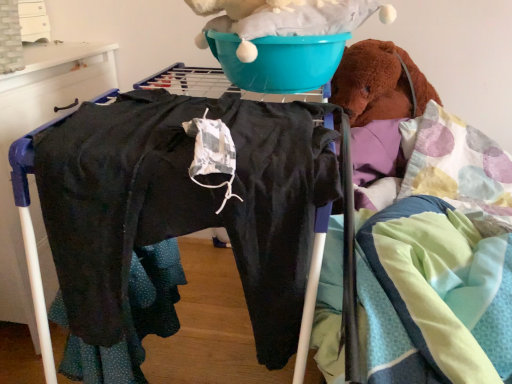
The width and height of the screenshot is (512, 384). What do you see at coordinates (280, 61) in the screenshot?
I see `teal plastic basin at upper center` at bounding box center [280, 61].

Locate an element on the screen. The height and width of the screenshot is (384, 512). teal plastic basin at upper center is located at coordinates click(280, 61).

Locate an element on the screen. dark gray fabric pants at left is located at coordinates (31, 130).

Describe the element at coordinates (31, 130) in the screenshot. I see `dark gray fabric pants at left` at that location.

This screenshot has height=384, width=512. I want to click on teal plastic basin at upper center, so click(x=280, y=61).

Considering the relative positions of dark gray fabric pants at left and teal plastic basin at upper center in the image provided, is dark gray fabric pants at left to the left or to the right of teal plastic basin at upper center?

In the image, dark gray fabric pants at left appears on the left side of teal plastic basin at upper center.

Is dark gray fabric pants at left in front of or behind teal plastic basin at upper center in the image?

In the image, dark gray fabric pants at left appears behind teal plastic basin at upper center.

Does point (36, 197) come closer to viewer compared to point (317, 72)?

Yes.

From the image's perspective, relative to teal plastic basin at upper center, is dark gray fabric pants at left above or below?

dark gray fabric pants at left is below teal plastic basin at upper center.

From a real-world perspective, who is located lower, dark gray fabric pants at left or teal plastic basin at upper center?

From a 3D spatial view, dark gray fabric pants at left is below.

Between dark gray fabric pants at left and teal plastic basin at upper center, which one has larger width?

dark gray fabric pants at left.

Considering the relative sizes of dark gray fabric pants at left and teal plastic basin at upper center in the image provided, is dark gray fabric pants at left taller than teal plastic basin at upper center?

Yes, dark gray fabric pants at left is taller than teal plastic basin at upper center.

Looking at the image, does dark gray fabric pants at left seem bigger or smaller compared to teal plastic basin at upper center?

dark gray fabric pants at left is bigger than teal plastic basin at upper center.

Is dark gray fabric pants at left not within teal plastic basin at upper center?

Yes.

Is dark gray fabric pants at left next to teal plastic basin at upper center?

There is a gap between dark gray fabric pants at left and teal plastic basin at upper center.

Does dark gray fabric pants at left turn towards teal plastic basin at upper center?

Yes, dark gray fabric pants at left is oriented towards teal plastic basin at upper center.

I want to click on basin that appears above the dark gray fabric pants at left (from the image's perspective), so click(x=280, y=61).

Considering the positions of objects teal plastic basin at upper center and dark gray fabric pants at left in the image provided, who is more to the left, teal plastic basin at upper center or dark gray fabric pants at left?

dark gray fabric pants at left is more to the left.

Between teal plastic basin at upper center and dark gray fabric pants at left, which one is positioned behind?

dark gray fabric pants at left is further from the camera.

In the scene shown: Which is farther from the camera, (251, 66) or (1, 251)?

The point (1, 251) is farther from the camera.

From the image's perspective, is teal plastic basin at upper center on dark gray fabric pants at left?

Indeed, from the image's perspective, teal plastic basin at upper center is shown above dark gray fabric pants at left.

From a real-world perspective, which is physically below, teal plastic basin at upper center or dark gray fabric pants at left?

dark gray fabric pants at left, from a real-world perspective.

Can you confirm if teal plastic basin at upper center is wider than dark gray fabric pants at left?

No, teal plastic basin at upper center is not wider than dark gray fabric pants at left.

Between teal plastic basin at upper center and dark gray fabric pants at left, which one has less height?

teal plastic basin at upper center is shorter.

Looking at this image, is teal plastic basin at upper center bigger than dark gray fabric pants at left?

Actually, teal plastic basin at upper center might be smaller than dark gray fabric pants at left.

Can we say teal plastic basin at upper center lies outside dark gray fabric pants at left?

Yes, teal plastic basin at upper center is outside of dark gray fabric pants at left.

Are teal plastic basin at upper center and dark gray fabric pants at left making contact?

teal plastic basin at upper center is not next to dark gray fabric pants at left, and they're not touching.

Is dark gray fabric pants at left at the back of teal plastic basin at upper center?

No, dark gray fabric pants at left is not at the back of teal plastic basin at upper center.

How far apart are teal plastic basin at upper center and dark gray fabric pants at left?

teal plastic basin at upper center is 27.62 inches away from dark gray fabric pants at left.

Identify the location of basin above the dark gray fabric pants at left (from a real-world perspective). (280, 61).

Find the location of a particular element. This screenshot has height=384, width=512. furniture located on the left of teal plastic basin at upper center is located at coordinates (31, 130).

The image size is (512, 384). I want to click on basin that appears on the right of dark gray fabric pants at left, so click(280, 61).